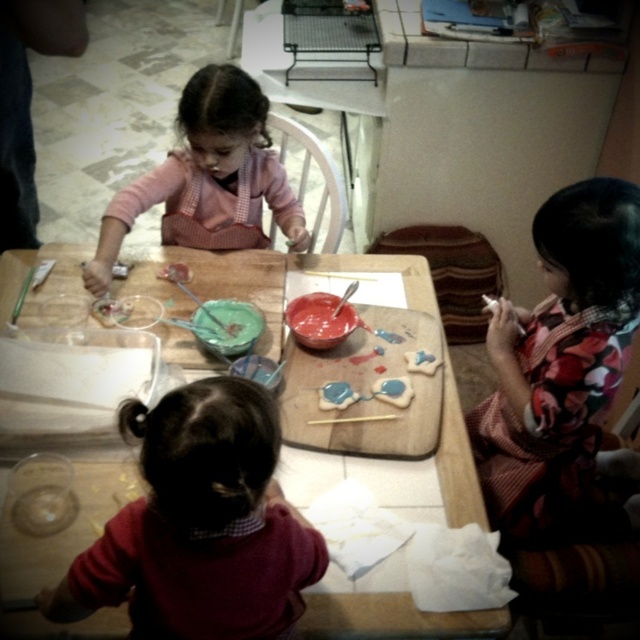
Between blue matte cookie at center and blue glossy cookie at center, which one appears on the right side from the viewer's perspective?

blue matte cookie at center is more to the right.

Does blue matte cookie at center appear on the left side of blue glossy cookie at center?

No, blue matte cookie at center is not to the left of blue glossy cookie at center.

Is point (381, 392) farther from camera compared to point (330, 381)?

No.

Where is `blue matte cookie at center`? The height and width of the screenshot is (640, 640). blue matte cookie at center is located at coordinates (394, 390).

Can you confirm if matte green plastic plate at center is positioned below blue matte cookie at center?

Actually, matte green plastic plate at center is above blue matte cookie at center.

Describe the element at coordinates (227, 324) in the screenshot. This screenshot has height=640, width=640. I see `matte green plastic plate at center` at that location.

This screenshot has height=640, width=640. What do you see at coordinates (227, 324) in the screenshot?
I see `matte green plastic plate at center` at bounding box center [227, 324].

Locate an element on the screen. This screenshot has height=640, width=640. matte green plastic plate at center is located at coordinates (227, 324).

Which is in front, point (321, 328) or point (387, 394)?

Point (387, 394) is more forward.

What do you see at coordinates (320, 320) in the screenshot? I see `smooth glossy red paint at center` at bounding box center [320, 320].

Describe the element at coordinates (320, 320) in the screenshot. I see `smooth glossy red paint at center` at that location.

Locate an element on the screen. The width and height of the screenshot is (640, 640). smooth glossy red paint at center is located at coordinates pyautogui.click(x=320, y=320).